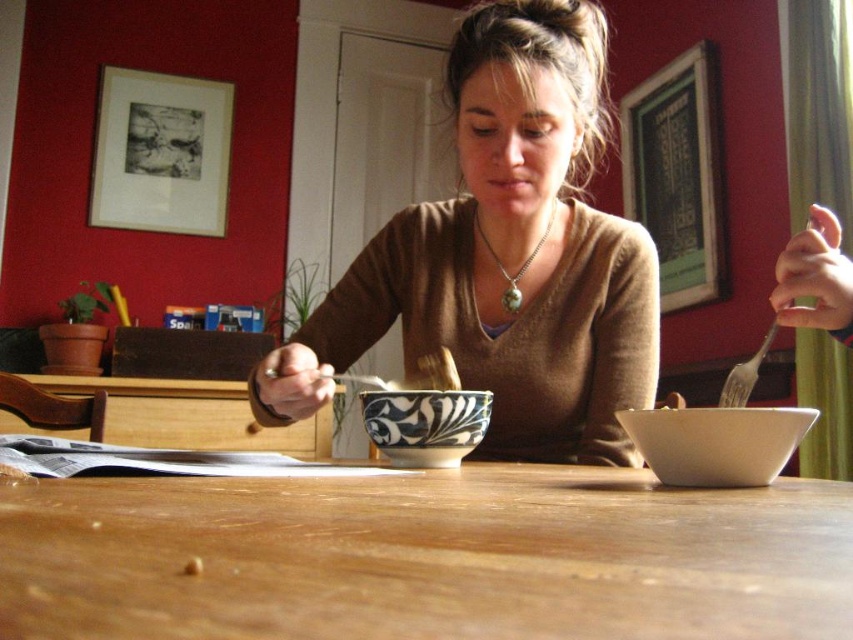
Question: Observing the image, what is the correct spatial positioning of matte brown sweater at center in reference to white matte bowl at center?

Choices:
 (A) left
 (B) right

Answer: (A)

Question: Does matte brown sweater at center appear on the right side of black and white ceramic bowl at center?

Choices:
 (A) no
 (B) yes

Answer: (B)

Question: Which point is closer to the camera?

Choices:
 (A) [512, 300]
 (B) [715, 454]
 (C) [434, 392]

Answer: (B)

Question: Which point is closer to the camera taking this photo?

Choices:
 (A) (663, 461)
 (B) (505, 310)
 (C) (590, 310)

Answer: (A)

Question: Which point is farther to the camera?

Choices:
 (A) matte brown sweater at center
 (B) green stone necklace at center

Answer: (B)

Question: Can you confirm if black and white ceramic bowl at center is smaller than green stone necklace at center?

Choices:
 (A) yes
 (B) no

Answer: (B)